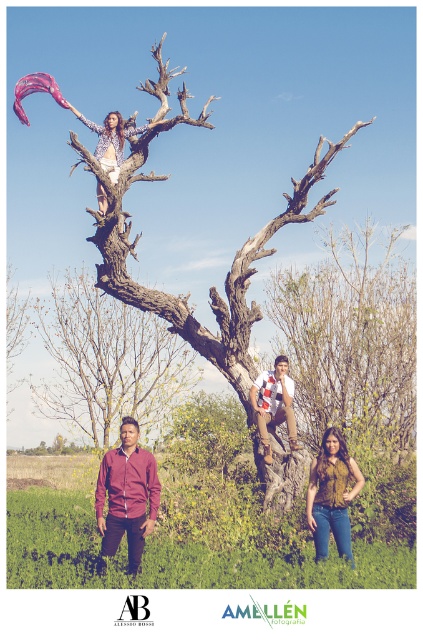
Question: Does brown textured tree trunk at upper center lie in front of white cotton shirt at center?

Choices:
 (A) no
 (B) yes

Answer: (B)

Question: Which of the following is the farthest from the observer?

Choices:
 (A) matte yellow blouse at lower right
 (B) brown textured tree trunk at upper center
 (C) white cotton shirt at center
 (D) smooth bark tree at center

Answer: (D)

Question: Is brown textured tree trunk at upper center to the left of matte yellow blouse at lower right from the viewer's perspective?

Choices:
 (A) yes
 (B) no

Answer: (A)

Question: Among these points, which one is farthest from the camera?

Choices:
 (A) (346, 460)
 (B) (101, 467)
 (C) (151, 417)

Answer: (C)

Question: Is matte yellow blouse at lower right further to camera compared to white cotton shirt at center?

Choices:
 (A) yes
 (B) no

Answer: (B)

Question: Which of the following is the closest to the observer?

Choices:
 (A) (134, 563)
 (B) (379, 376)

Answer: (A)